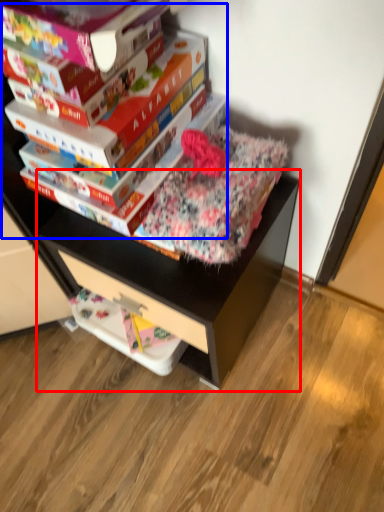
Question: Among these objects, which one is farthest to the camera, computer desk (highlighted by a red box) or paperback book (highlighted by a blue box)?

Choices:
 (A) computer desk
 (B) paperback book

Answer: (A)